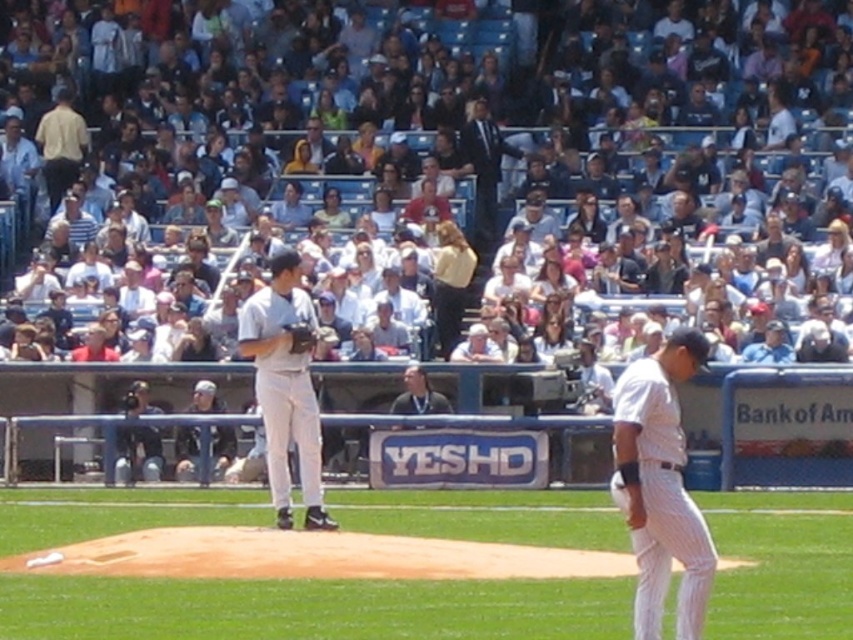
Between white cotton crowd at upper center and white matte baseball at center, which one has more height?

With more height is white cotton crowd at upper center.

Between white cotton crowd at upper center and white matte baseball at center, which one is positioned lower?

white matte baseball at center

Does point (198, 192) come closer to viewer compared to point (315, 499)?

No.

Find the location of `white cotton crowd at upper center`. white cotton crowd at upper center is located at coordinates (459, 108).

Can you confirm if white pinstriped uniform at center is wider than matte yellow shirt at upper left?

Incorrect, white pinstriped uniform at center's width does not surpass matte yellow shirt at upper left's.

Does white pinstriped uniform at center appear under matte yellow shirt at upper left?

Yes.

Locate an element on the screen. white pinstriped uniform at center is located at coordinates (660, 486).

You are a GUI agent. You are given a task and a screenshot of the screen. Output one action in this format:
    pyautogui.click(x=<x>, y=<y>)
    Task: Click on the white pinstriped uniform at center
    
    Given the screenshot: What is the action you would take?
    pyautogui.click(x=660, y=486)

Between white matte baseball at center and dark brown leather glove at center, which one is positioned higher?

Positioned higher is dark brown leather glove at center.

Is white matte baseball at center to the right of dark brown leather glove at center from the viewer's perspective?

Incorrect, white matte baseball at center is not on the right side of dark brown leather glove at center.

Find the location of `white matte baseball at center`. white matte baseball at center is located at coordinates (285, 385).